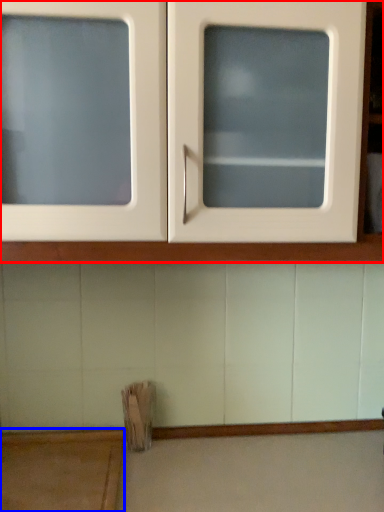
Question: Which point is further to the camera, cabinetry (highlighted by a red box) or table (highlighted by a blue box)?

Choices:
 (A) cabinetry
 (B) table

Answer: (B)